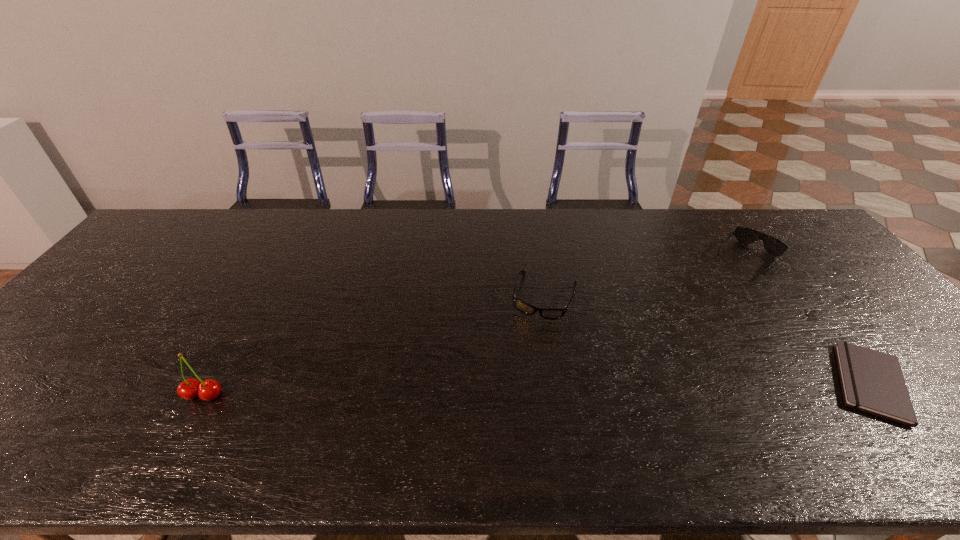
This screenshot has width=960, height=540. I want to click on the leftmost object, so click(x=189, y=389).

Identify the location of cherry. (189, 389).

Where is `checkbook`? The width and height of the screenshot is (960, 540). checkbook is located at coordinates (871, 381).

Identify the location of sunglasses. (772, 245).

This screenshot has height=540, width=960. Find the location of `spectacles`. spectacles is located at coordinates (548, 313).

I want to click on free space located on the left of the checkbook, so click(705, 383).

Locate an element on the screen. This screenshot has width=960, height=540. free space located on the front-facing side of the sunglasses is located at coordinates (708, 305).

Where is `vacant space located on the front-facing side of the sunglasses`? This screenshot has height=540, width=960. vacant space located on the front-facing side of the sunglasses is located at coordinates (703, 310).

Image resolution: width=960 pixels, height=540 pixels. I want to click on free space located 0.210m on the front-facing side of the sunglasses, so click(703, 310).

The width and height of the screenshot is (960, 540). Find the location of `free space located on the front-facing side of the spectacles`. free space located on the front-facing side of the spectacles is located at coordinates (521, 375).